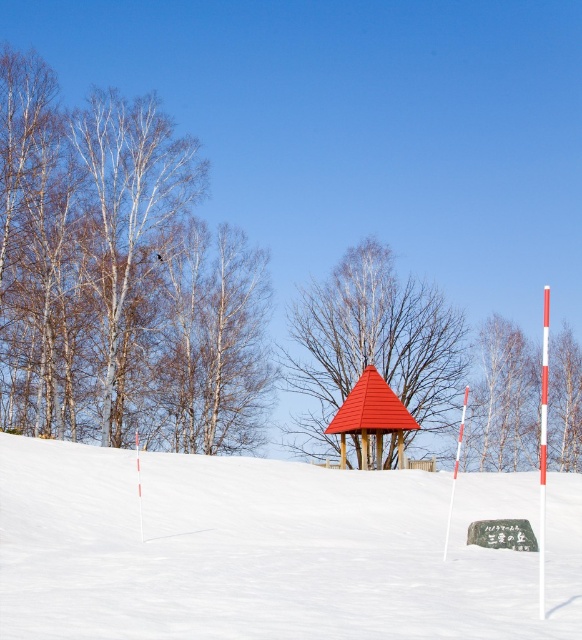
You are planning to take a photo of the smooth wooden gazebo at center and the brown wood tree at center from the bottom of the hill. Which object will appear taller in the photo?

The smooth wooden gazebo at center is much taller as brown wood tree at center, so it will appear taller in the photo.

You are planning to build a small garden in your backyard. You have two items to place there, the smooth wooden gazebo at center and the brown wood tree at center. If you want to ensure the gazebo is more prominent than the tree, which object should you place in a larger size?

The smooth wooden gazebo at center should be placed in a larger size to ensure it is more prominent than the brown wood tree at center.